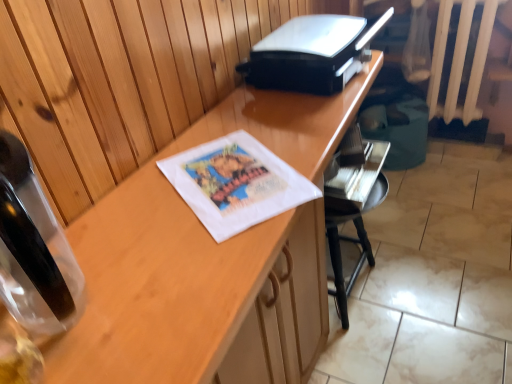
Question: From a real-world perspective, is black plastic printer at upper center physically located above or below wooden desk at center?

Choices:
 (A) above
 (B) below

Answer: (A)

Question: Considering the positions of point (311, 64) and point (214, 347), is point (311, 64) closer or farther from the camera than point (214, 347)?

Choices:
 (A) closer
 (B) farther

Answer: (B)

Question: Is black plastic printer at upper center bigger or smaller than wooden desk at center?

Choices:
 (A) big
 (B) small

Answer: (B)

Question: Is wooden desk at center bigger or smaller than black plastic printer at upper center?

Choices:
 (A) big
 (B) small

Answer: (A)

Question: From a real-world perspective, relative to black plastic printer at upper center, is wooden desk at center vertically above or below?

Choices:
 (A) below
 (B) above

Answer: (A)

Question: Is wooden desk at center wider or thinner than black plastic printer at upper center?

Choices:
 (A) thin
 (B) wide

Answer: (B)

Question: Would you say wooden desk at center is to the left or to the right of black plastic printer at upper center in the picture?

Choices:
 (A) left
 (B) right

Answer: (A)